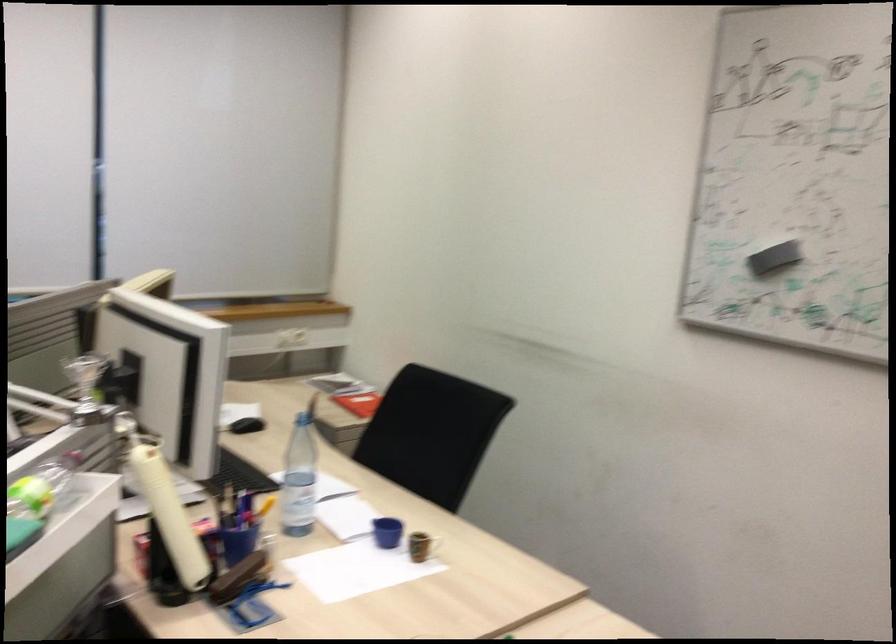
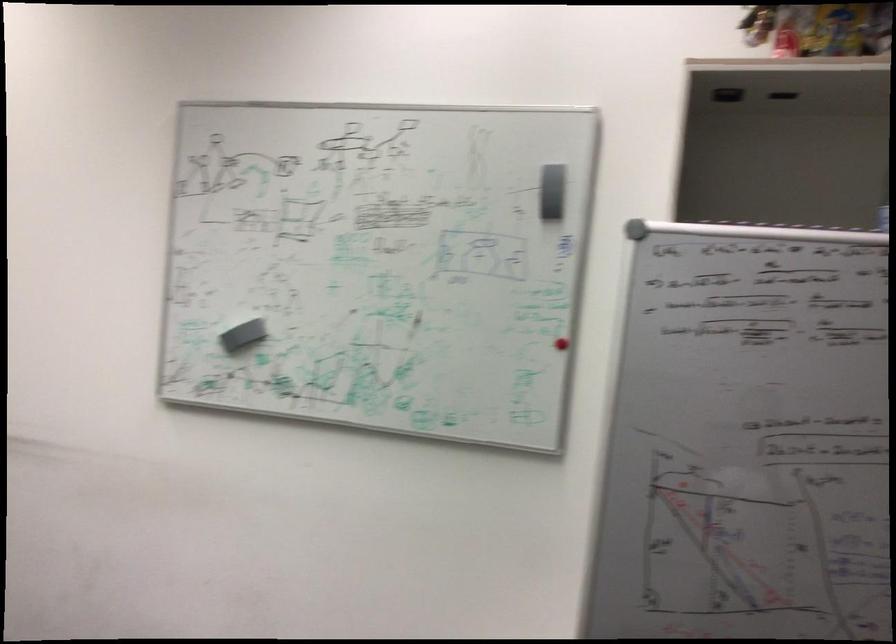
Question: The first image is from the beginning of the video and the second image is from the end. How did the camera likely rotate when shooting the video?

Choices:
 (A) Left
 (B) Right
 (C) Up
 (D) Down

Answer: (B)